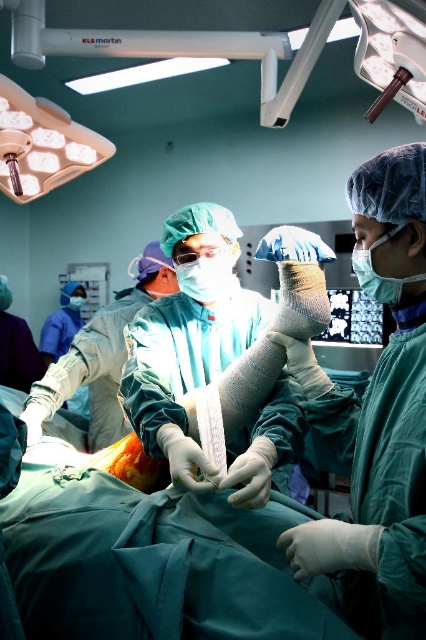
Question: Does white plastic surgical light at upper center appear over white matte surgical gown at center?

Choices:
 (A) no
 (B) yes

Answer: (B)

Question: Which point is closer to the camera?

Choices:
 (A) (175, 289)
 (B) (365, 4)

Answer: (B)

Question: Does white plastic surgical light at upper center appear under white matte surgical gown at center?

Choices:
 (A) yes
 (B) no

Answer: (B)

Question: Among these objects, which one is nearest to the camera?

Choices:
 (A) white plastic surgical light at upper center
 (B) white bandaged hand at center

Answer: (A)

Question: Considering the real-world distances, which object is closest to the white bandaged hand at center?

Choices:
 (A) white matte surgical gown at center
 (B) white plastic surgical light at upper center

Answer: (A)

Question: Can you confirm if white bandaged hand at center is positioned below white plastic surgical light at upper center?

Choices:
 (A) yes
 (B) no

Answer: (A)